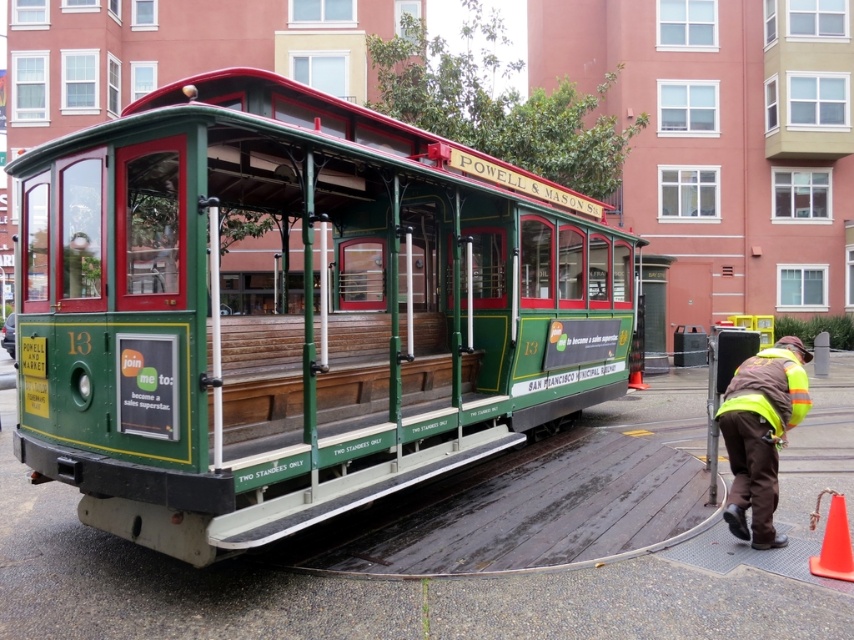
Measure the distance between high-visibility reflective vest at lower right and orange plastic cone at lower right.

high-visibility reflective vest at lower right is 25.98 inches away from orange plastic cone at lower right.

Is point (771, 493) closer to camera compared to point (816, 564)?

No.

Locate an element on the screen. high-visibility reflective vest at lower right is located at coordinates (761, 433).

Is green polished wood cable car at center taller than high-visibility reflective vest at lower right?

Indeed, green polished wood cable car at center has a greater height compared to high-visibility reflective vest at lower right.

I want to click on green polished wood cable car at center, so click(x=294, y=312).

Is green polished wood cable car at center taller than high-visibility fabric safety vest at lower right?

Yes.

Between point (341, 496) and point (736, 400), which one is positioned behind?

Point (736, 400)

At what (x,y) coordinates should I click in order to perform the action: click on green polished wood cable car at center. Please return your answer as a coordinate pair (x, y). Looking at the image, I should click on (294, 312).